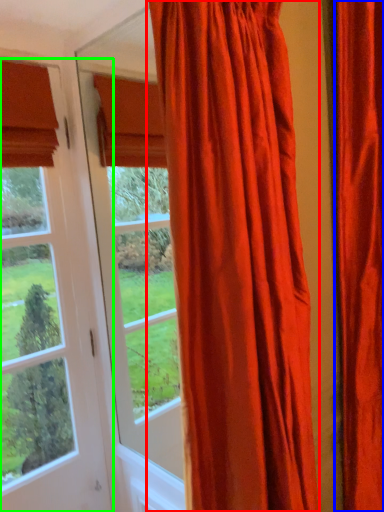
Question: Which object is the farthest from curtain (highlighted by a red box)? Choose among these: curtain (highlighted by a blue box) or window (highlighted by a green box).

Choices:
 (A) curtain
 (B) window

Answer: (B)